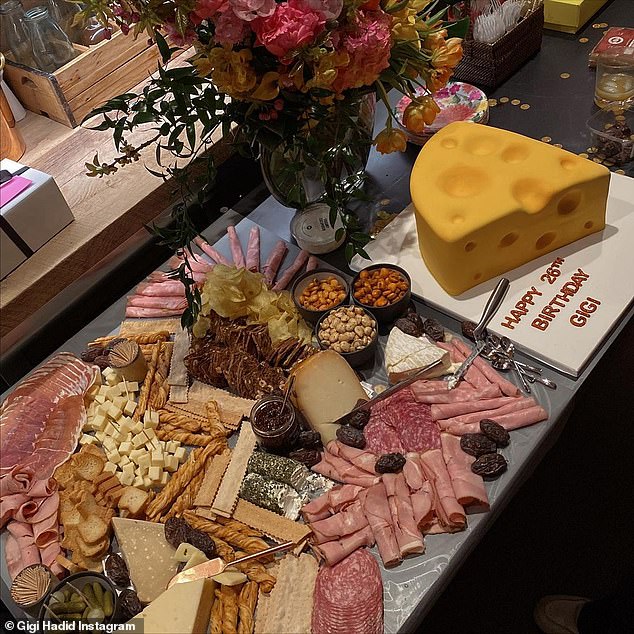
Locate an element on the screen. This screenshot has height=634, width=634. black bowls is located at coordinates (345, 286), (372, 318), (384, 307).